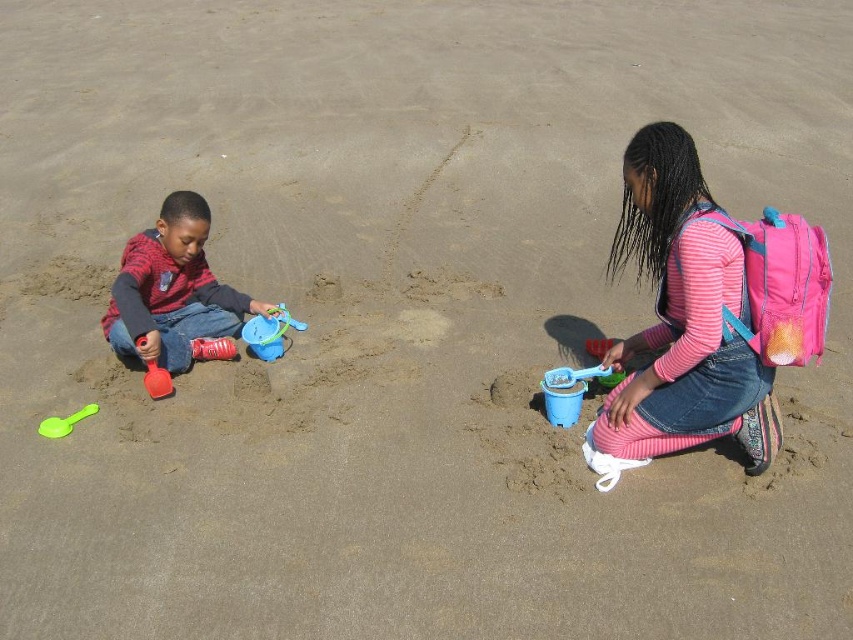
You are a parent trying to locate your children on the beach. You remember your son is wearing a matte red shirt at left and your daughter has a pink fabric backpack at right. Based on the scene description, which child is closer to the ocean?

The pink fabric backpack at right is to the right of the matte red shirt at left. Since the children are positioned with the boy on the left and the girl on the right, the girl with the pink fabric backpack at right is closer to the ocean.

You are a photographer trying to capture a closeup of the matte red shirt at left and the blue plastic shovel at center. If you want to ensure both are fully visible in the frame without cropping, which object should you position closer to the camera?

The matte red shirt at left might be wider than blue plastic shovel at center, so you should position the matte red shirt at left closer to the camera to ensure it fits within the frame.